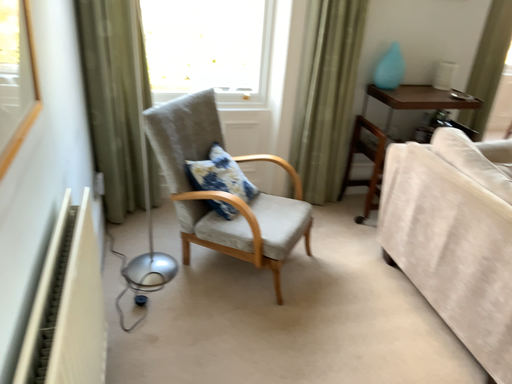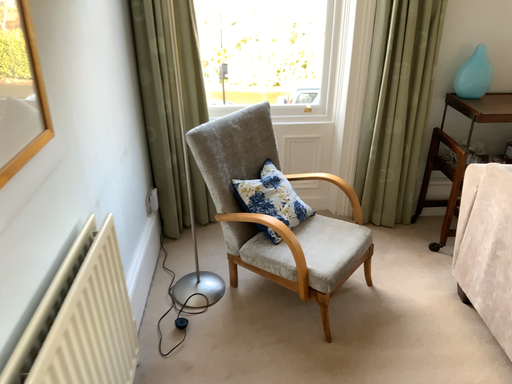
Question: Which way did the camera rotate in the video?

Choices:
 (A) rotated right
 (B) rotated left

Answer: (B)